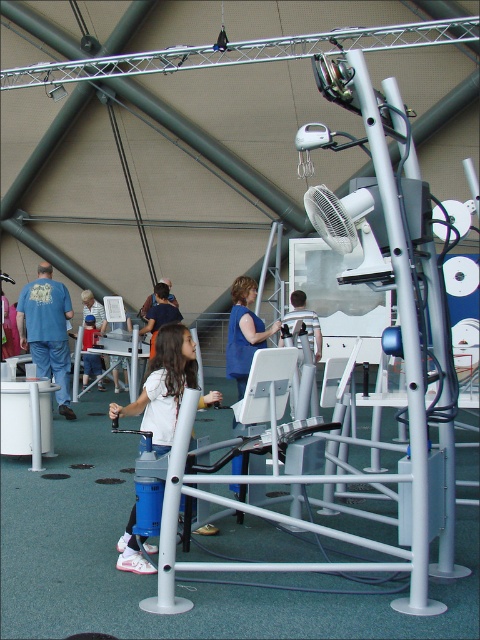
You are a visitor at the science center and you see a young girl wearing the blue denim jeans at left and the blue fabric shirt at center. Which piece of clothing is larger?

The blue denim jeans at left is bigger than the blue fabric shirt at center.